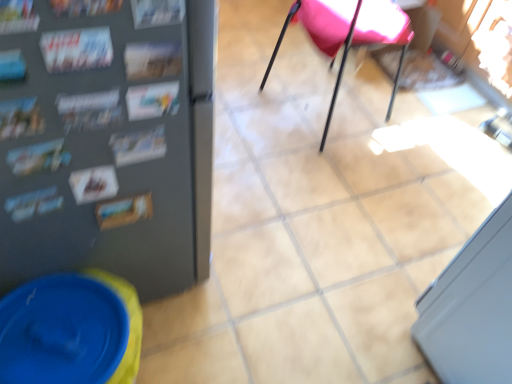
Question: Is printed paper magazine at left, placed as the first magazine when sorted from left to right, situated inside printed paper magazine at upper left, which ranks as the second magazine in right-to-left order, or outside?

Choices:
 (A) outside
 (B) inside

Answer: (A)

Question: From the image's perspective, is printed paper magazine at left, which ranks as the 3th magazine in right-to-left order, located above or below printed paper magazine at upper left, which ranks as the second magazine in right-to-left order?

Choices:
 (A) below
 (B) above

Answer: (A)

Question: Estimate the real-world distances between objects in this image. Which object is farther from the matte paper magazine at upper left, the 1th magazine viewed from the right?

Choices:
 (A) printed paper magazine at upper left, which ranks as the second magazine in right-to-left order
 (B) printed paper magazine at left, placed as the first magazine when sorted from left to right
 (C) pink fabric chair at center

Answer: (C)

Question: Which object is the farthest from the printed paper magazine at left, placed as the first magazine when sorted from left to right?

Choices:
 (A) printed paper magazine at upper left, which ranks as the second magazine in right-to-left order
 (B) matte paper magazine at upper left, which is counted as the 3th magazine, starting from the left
 (C) pink fabric chair at center

Answer: (C)